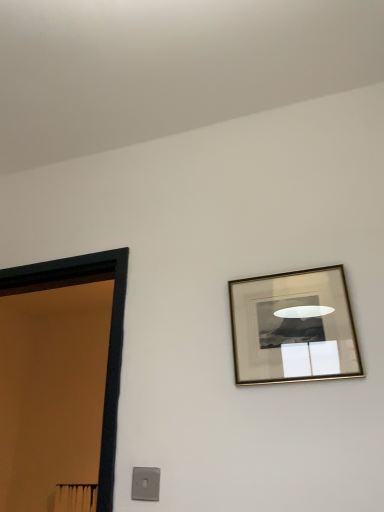
Locate an element on the screen. The height and width of the screenshot is (512, 384). satin silver switch at lower left is located at coordinates (145, 483).

This screenshot has width=384, height=512. I want to click on black wooden door at left, so click(110, 332).

You are a GUI agent. You are given a task and a screenshot of the screen. Output one action in this format:
    pyautogui.click(x=<x>, y=<y>)
    Task: Click on the gold metallic picture frame at upper right
    The height and width of the screenshot is (512, 384).
    Given the screenshot: What is the action you would take?
    pyautogui.click(x=293, y=327)

From the picture: Considering the relative sizes of gold metallic picture frame at upper right and satin silver switch at lower left in the image provided, is gold metallic picture frame at upper right thinner than satin silver switch at lower left?

Incorrect, the width of gold metallic picture frame at upper right is not less than that of satin silver switch at lower left.

Does gold metallic picture frame at upper right touch satin silver switch at lower left?

They are not placed beside each other.

From a real-world perspective, is gold metallic picture frame at upper right under satin silver switch at lower left?

No, from a real-world perspective, gold metallic picture frame at upper right is not below satin silver switch at lower left.

From their relative heights in the image, would you say gold metallic picture frame at upper right is taller or shorter than satin silver switch at lower left?

Clearly, gold metallic picture frame at upper right is taller compared to satin silver switch at lower left.

Which is more to the left, satin silver switch at lower left or gold metallic picture frame at upper right?

Positioned to the left is satin silver switch at lower left.

Is point (133, 490) farther from viewer compared to point (322, 316)?

That is False.

Does satin silver switch at lower left have a lesser height compared to gold metallic picture frame at upper right?

Yes.

Is black wooden door at left facing towards gold metallic picture frame at upper right?

No, black wooden door at left is not oriented towards gold metallic picture frame at upper right.

Is black wooden door at left bigger than gold metallic picture frame at upper right?

Yes, black wooden door at left is bigger than gold metallic picture frame at upper right.

From the image's perspective, is black wooden door at left on gold metallic picture frame at upper right?

Actually, black wooden door at left appears below gold metallic picture frame at upper right in the image.

Consider the image. Is black wooden door at left far away from gold metallic picture frame at upper right?

black wooden door at left is actually quite close to gold metallic picture frame at upper right.

In the scene shown: Is gold metallic picture frame at upper right looking in the opposite direction of black wooden door at left?

gold metallic picture frame at upper right is not turned away from black wooden door at left.

Between gold metallic picture frame at upper right and black wooden door at left, which one has larger width?

With larger width is black wooden door at left.

Considering the relative positions of gold metallic picture frame at upper right and black wooden door at left in the image provided, is gold metallic picture frame at upper right behind black wooden door at left?

That is False.

Considering the relative positions of gold metallic picture frame at upper right and black wooden door at left in the image provided, is gold metallic picture frame at upper right to the right of black wooden door at left from the viewer's perspective?

Yes.

Is satin silver switch at lower left facing towards black wooden door at left?

No, satin silver switch at lower left is not facing towards black wooden door at left.

Are satin silver switch at lower left and black wooden door at left making contact?

No.

At what (x,y) coordinates should I click in order to perform the action: click on door lying behind the satin silver switch at lower left. Please return your answer as a coordinate pair (x, y). Looking at the image, I should click on (110, 332).

Is satin silver switch at lower left to the left or to the right of black wooden door at left in the image?

satin silver switch at lower left is to the right of black wooden door at left.

From the image's perspective, would you say black wooden door at left is positioned over satin silver switch at lower left?

Yes.

Considering the relative positions of black wooden door at left and satin silver switch at lower left in the image provided, is black wooden door at left in front of satin silver switch at lower left?

No, the depth of black wooden door at left is greater than that of satin silver switch at lower left.

Is black wooden door at left wider or thinner than satin silver switch at lower left?

Clearly, black wooden door at left has more width compared to satin silver switch at lower left.

Would you consider black wooden door at left to be distant from satin silver switch at lower left?

No, black wooden door at left is in close proximity to satin silver switch at lower left.

Where is `picture frame above the satin silver switch at lower left (from the image's perspective)`? picture frame above the satin silver switch at lower left (from the image's perspective) is located at coordinates (293, 327).

Identify the location of picture frame that is above the satin silver switch at lower left (from a real-world perspective). The image size is (384, 512). coord(293,327).

Estimate the real-world distances between objects in this image. Which object is closer to satin silver switch at lower left, gold metallic picture frame at upper right or black wooden door at left?

black wooden door at left is positioned closer to the anchor satin silver switch at lower left.

Which object lies nearer to the anchor point gold metallic picture frame at upper right, black wooden door at left or satin silver switch at lower left?

satin silver switch at lower left is positioned closer to the anchor gold metallic picture frame at upper right.

When comparing their distances from satin silver switch at lower left, does black wooden door at left or gold metallic picture frame at upper right seem further?

gold metallic picture frame at upper right is further to satin silver switch at lower left.

Based on their spatial positions, is satin silver switch at lower left or gold metallic picture frame at upper right closer to black wooden door at left?

Among the two, satin silver switch at lower left is located nearer to black wooden door at left.

Estimate the real-world distances between objects in this image. Which object is further from gold metallic picture frame at upper right, satin silver switch at lower left or black wooden door at left?

Based on the image, black wooden door at left appears to be further to gold metallic picture frame at upper right.

When comparing their distances from black wooden door at left, does gold metallic picture frame at upper right or satin silver switch at lower left seem closer?

satin silver switch at lower left is positioned closer to the anchor black wooden door at left.

Image resolution: width=384 pixels, height=512 pixels. Identify the location of light switch between black wooden door at left and gold metallic picture frame at upper right from left to right. (145, 483).